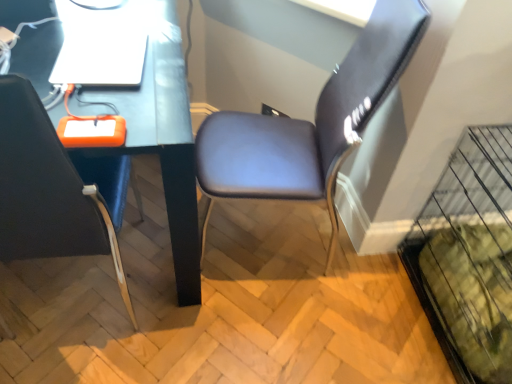
The height and width of the screenshot is (384, 512). In order to click on vacant space to the right of matte black chair at left, placed as the 2th chair when sorted from right to left in this screenshot , I will do `click(205, 328)`.